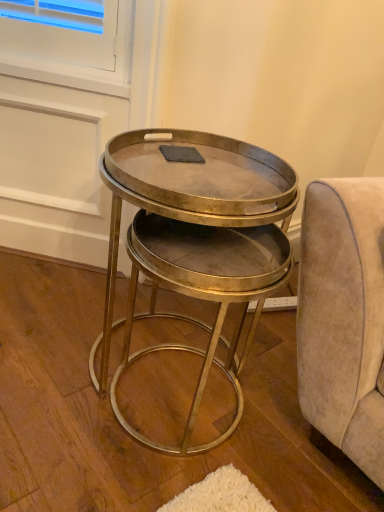
Describe the element at coordinates (197, 243) in the screenshot. I see `metallic gold table at center` at that location.

Where is `metallic gold table at center`? metallic gold table at center is located at coordinates (197, 243).

At what (x,y) coordinates should I click in order to perform the action: click on gray matte rectangular pad at center. Please return your answer as a coordinate pair (x, y). The image size is (384, 512). Looking at the image, I should click on (181, 154).

Describe the element at coordinates (181, 154) in the screenshot. The image size is (384, 512). I see `gray matte rectangular pad at center` at that location.

In the scene shown: Measure the distance between gray matte rectangular pad at center and camera.

gray matte rectangular pad at center is 3.39 feet from camera.

Where is `metallic gold table at center`? metallic gold table at center is located at coordinates (197, 243).

Is gray matte rectangular pad at center to the left of metallic gold table at center from the viewer's perspective?

Indeed, gray matte rectangular pad at center is positioned on the left side of metallic gold table at center.

Is gray matte rectangular pad at center positioned before metallic gold table at center?

No, the depth of gray matte rectangular pad at center is greater than that of metallic gold table at center.

Consider the image. Which is closer to the camera, (170, 159) or (280, 250)?

Point (170, 159) is farther from the camera than point (280, 250).

From the image's perspective, is gray matte rectangular pad at center above or below metallic gold table at center?

gray matte rectangular pad at center is above metallic gold table at center.

From a real-world perspective, which object stands above the other?

In real-world perspective, gray matte rectangular pad at center is above.

In terms of width, does gray matte rectangular pad at center look wider or thinner when compared to metallic gold table at center?

In the image, gray matte rectangular pad at center appears to be more narrow than metallic gold table at center.

Who is shorter, gray matte rectangular pad at center or metallic gold table at center?

Standing shorter between the two is gray matte rectangular pad at center.

Between gray matte rectangular pad at center and metallic gold table at center, which one has smaller size?

Smaller between the two is gray matte rectangular pad at center.

Can metallic gold table at center be found inside gray matte rectangular pad at center?

No.

From the picture: Is gray matte rectangular pad at center positioned far away from metallic gold table at center?

Actually, gray matte rectangular pad at center and metallic gold table at center are a little close together.

Could you tell me if gray matte rectangular pad at center is turned towards metallic gold table at center?

No.

How different are the orientations of gray matte rectangular pad at center and metallic gold table at center in degrees?

They differ by 70.9 degrees in their facing directions.

This screenshot has height=512, width=384. In order to click on table directly beneath the gray matte rectangular pad at center (from a real-world perspective) in this screenshot , I will do `click(197, 243)`.

Which is more to the right, metallic gold table at center or gray matte rectangular pad at center?

From the viewer's perspective, metallic gold table at center appears more on the right side.

Which object is closer to the camera taking this photo, metallic gold table at center or gray matte rectangular pad at center?

metallic gold table at center is more forward.

Does point (237, 210) come in front of point (188, 158)?

Yes.

From the image's perspective, between metallic gold table at center and gray matte rectangular pad at center, who is located below?

From the image's view, metallic gold table at center is below.

Based on the photo, from a real-world perspective, is metallic gold table at center positioned under gray matte rectangular pad at center based on gravity?

Correct, in the physical world, metallic gold table at center is lower than gray matte rectangular pad at center.

Does metallic gold table at center have a greater width compared to gray matte rectangular pad at center?

Correct, the width of metallic gold table at center exceeds that of gray matte rectangular pad at center.

In the scene shown: Is metallic gold table at center shorter than gray matte rectangular pad at center?

In fact, metallic gold table at center may be taller than gray matte rectangular pad at center.

Looking at the image, does metallic gold table at center seem bigger or smaller compared to gray matte rectangular pad at center?

metallic gold table at center is bigger than gray matte rectangular pad at center.

Could gray matte rectangular pad at center be considered to be inside metallic gold table at center?

No, gray matte rectangular pad at center is located outside of metallic gold table at center.

Is metallic gold table at center next to gray matte rectangular pad at center and touching it?

No, metallic gold table at center is not beside gray matte rectangular pad at center.

Is metallic gold table at center oriented towards gray matte rectangular pad at center?

No, metallic gold table at center is not oriented towards gray matte rectangular pad at center.

How different are the orientations of metallic gold table at center and gray matte rectangular pad at center in degrees?

70.9 degrees.

How distant is metallic gold table at center from gray matte rectangular pad at center?

They are 11.53 inches apart.

Locate an element on the screen. table below the gray matte rectangular pad at center (from a real-world perspective) is located at coordinates (197, 243).

This screenshot has width=384, height=512. Find the location of `pad above the metallic gold table at center (from a real-world perspective)`. pad above the metallic gold table at center (from a real-world perspective) is located at coordinates (181, 154).

This screenshot has width=384, height=512. In order to click on table on the right of the gray matte rectangular pad at center in this screenshot , I will do `click(197, 243)`.